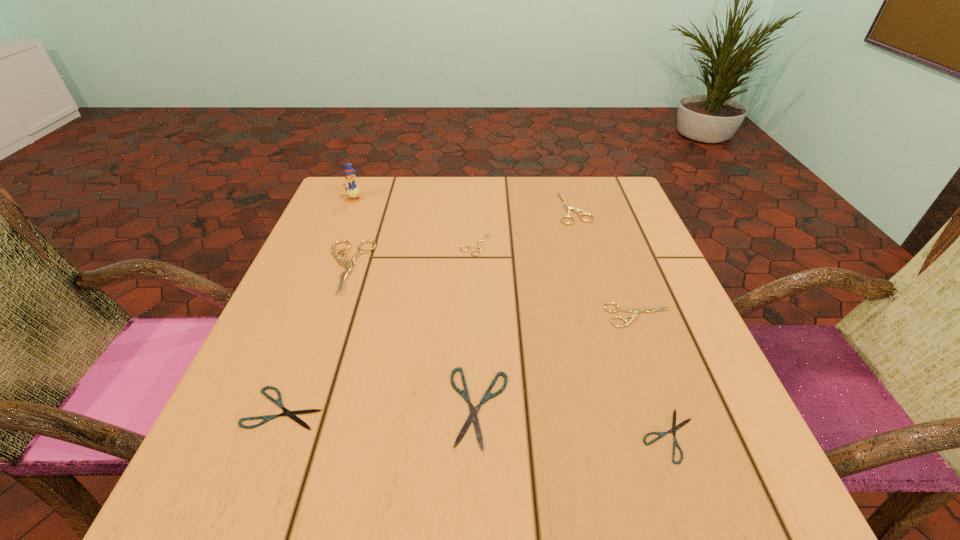
Find the location of `duckling`. duckling is located at coordinates (352, 190).

The height and width of the screenshot is (540, 960). I want to click on the tallest object, so click(x=352, y=190).

Locate an element on the screen. The image size is (960, 540). the tallest shears is located at coordinates (349, 265).

At what (x,y) coordinates should I click in order to perform the action: click on the second tallest object. Please return your answer as a coordinate pair (x, y). Image resolution: width=960 pixels, height=540 pixels. Looking at the image, I should click on (349, 265).

Image resolution: width=960 pixels, height=540 pixels. What are the coordinates of `the third smallest beige shears` in the screenshot? It's located at (577, 210).

Locate an element on the screen. This screenshot has width=960, height=540. the farthest shears is located at coordinates (577, 210).

At what (x,y) coordinates should I click in order to perform the action: click on the nearest beige shears. Please return your answer as a coordinate pair (x, y). Looking at the image, I should click on (636, 311).

Image resolution: width=960 pixels, height=540 pixels. What are the coordinates of `the fourth nearest shears` in the screenshot? It's located at (636, 311).

Locate an element on the screen. The width and height of the screenshot is (960, 540). the second black shears from left to right is located at coordinates (464, 393).

You are a GUI agent. You are given a task and a screenshot of the screen. Output one action in this format:
    pyautogui.click(x=<x>, y=<y>)
    Task: Click on the smallest beige shears
    This screenshot has height=540, width=960.
    Given the screenshot: What is the action you would take?
    pyautogui.click(x=478, y=244)